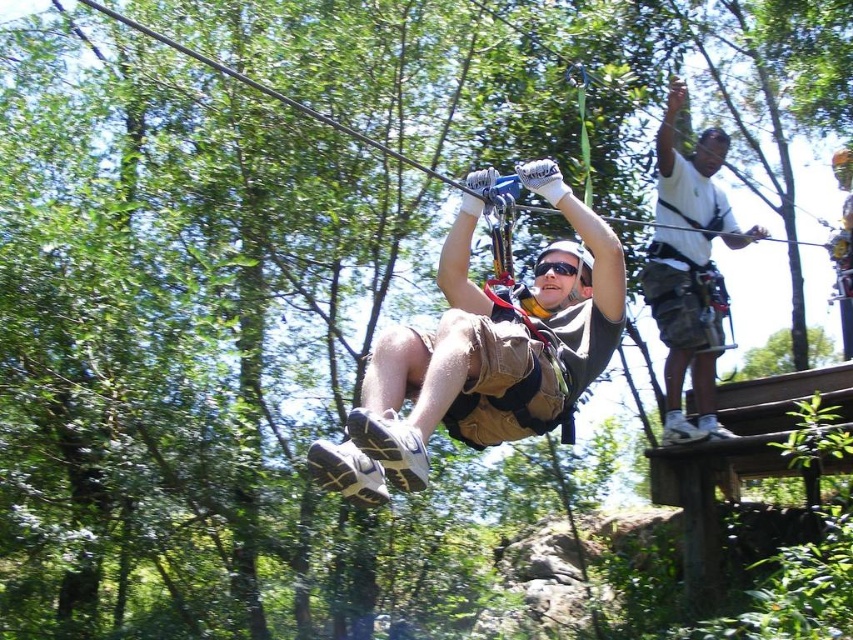
You are a photographer trying to capture the zip line setup. You notice two points marked as point (469, 376) and point (682, 88) in the image. Which point is closer to your camera lens?

Point (469, 376) is closer to the camera lens than point (682, 88).

You are a safety inspector checking the zip line participant. You notice the tan fabric shorts at center and the black matte goggles at center. Which item is positioned more to the left?

The tan fabric shorts at center are to the left of the black matte goggles at center, so the tan fabric shorts at center are positioned more to the left.

You are a safety inspector checking the zip line setup. You notice the white cotton shirt at upper right and the black matte goggles at center. According to safety protocols, which item should be positioned higher to ensure proper visibility for the rider?

The black matte goggles at center should be positioned higher than the white cotton shirt at upper right to ensure proper visibility for the rider.